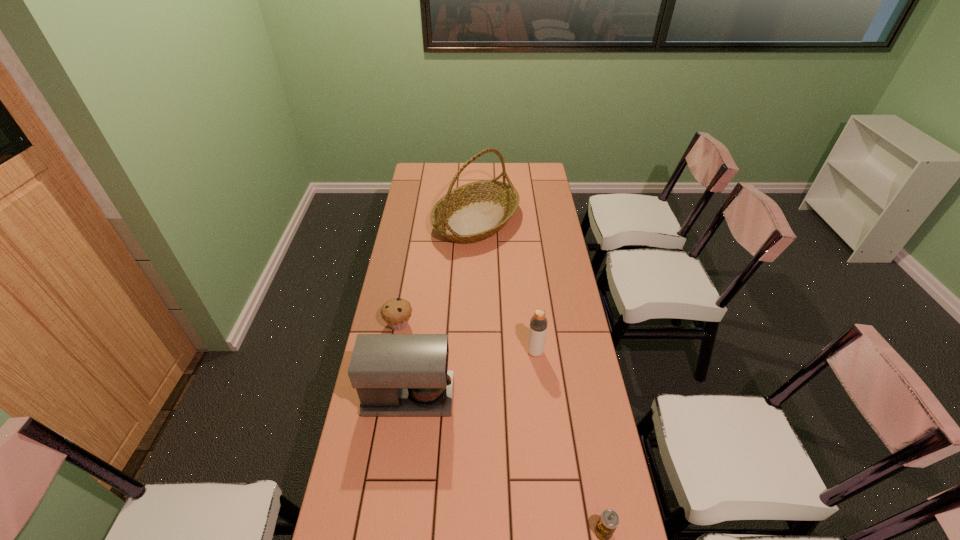
I want to click on vacant space in between the bottle and the muffin, so [x=467, y=338].

Identify the location of empty space between the tallest object and the second nearest object. (443, 309).

Locate which object ranks in proximity to the tallest object. Please provide its 2D coordinates. Your answer should be formatted as a tuple, i.e. [(x, y)], where the tuple contains the x and y coordinates of a point satisfying the conditions above.

[(396, 312)]

Find the location of `object that ranks as the second closest to the muffin`. object that ranks as the second closest to the muffin is located at coordinates (475, 211).

Find the location of a particular element. The image size is (960, 540). free space that satisfies the following two spatial constraints: 1. on the front side of the bottle; 2. on the carafe side of the coffee maker is located at coordinates (540, 397).

Find the location of a particular element. The image size is (960, 540). free spot that satisfies the following two spatial constraints: 1. on the front side of the bottle; 2. on the carafe side of the coffee maker is located at coordinates (540, 397).